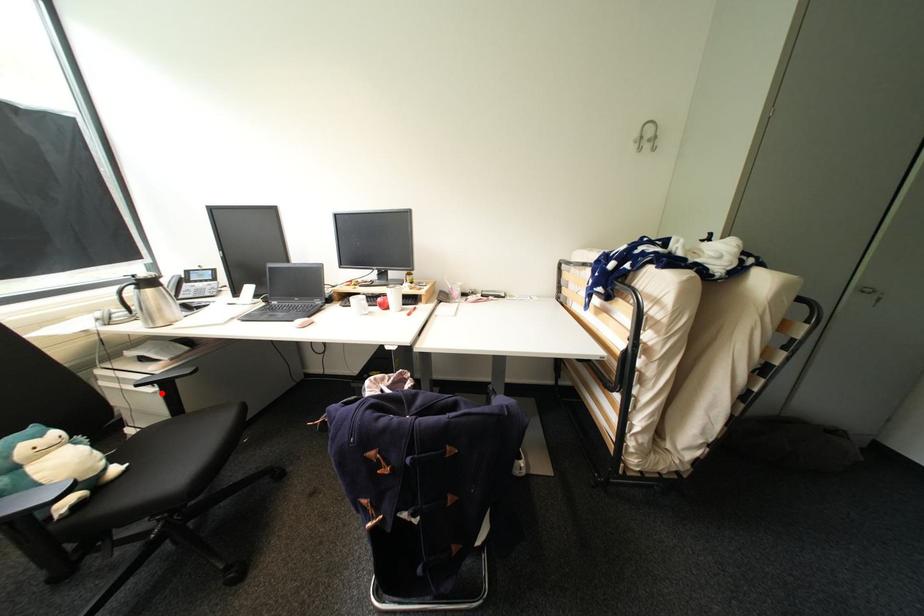
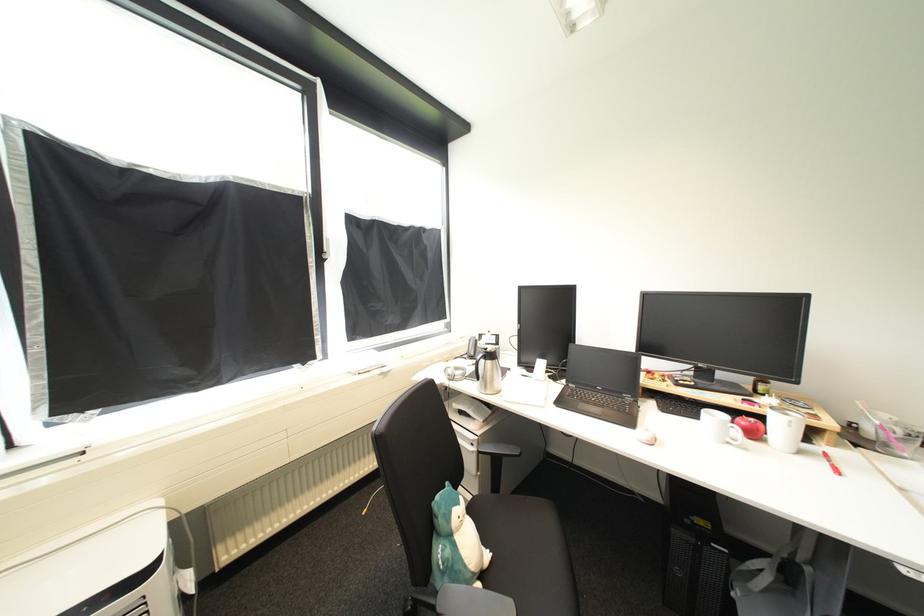
Question: A red point is marked in image1. In image2, is the corresponding 3D point closer to the camera or farther? Reply with the corresponding letter.

Choices:
 (A) The corresponding 3D point is closer.
 (B) The corresponding 3D point is farther.

Answer: (B)